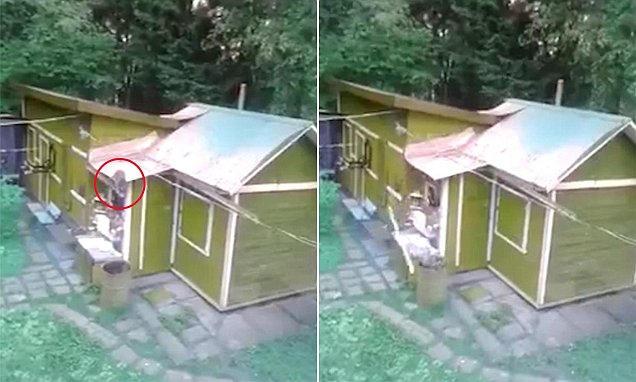
Identify the location of chimney. This screenshot has width=636, height=382. [x=561, y=98].